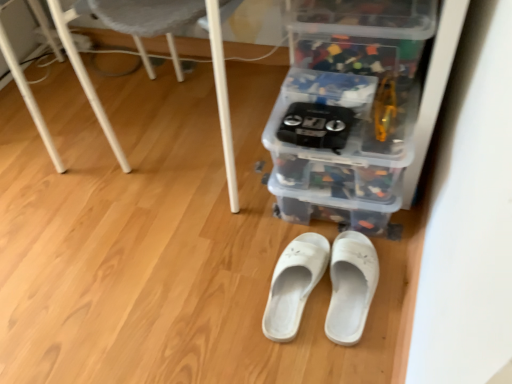
Question: Is translucent plastic storage box at center, the 3th storage box in the bottom-to-top sequence, taller than white fabric slippers at center, the 1th footwear from the left?

Choices:
 (A) no
 (B) yes

Answer: (B)

Question: From a real-world perspective, is translucent plastic storage box at center, the 1th storage box in the top-to-bottom sequence, on top of white fabric slippers at center, placed as the second footwear when sorted from right to left?

Choices:
 (A) yes
 (B) no

Answer: (A)

Question: Can you confirm if translucent plastic storage box at center, the 3th storage box in the bottom-to-top sequence, is thinner than white fabric slippers at center, the 1th footwear from the left?

Choices:
 (A) yes
 (B) no

Answer: (A)

Question: Is translucent plastic storage box at center, the 3th storage box in the bottom-to-top sequence, to the right of white fabric slippers at center, the 1th footwear from the left, from the viewer's perspective?

Choices:
 (A) no
 (B) yes

Answer: (B)

Question: From the image's perspective, is translucent plastic storage box at center, the 3th storage box in the bottom-to-top sequence, over white fabric slippers at center, the 1th footwear from the left?

Choices:
 (A) no
 (B) yes

Answer: (B)

Question: Which is correct: translucent plastic storage box at center, the 3th storage box in the bottom-to-top sequence, is inside white plastic chair at lower center, or outside of it?

Choices:
 (A) outside
 (B) inside

Answer: (A)

Question: Is point (369, 46) closer or farther from the camera than point (152, 4)?

Choices:
 (A) farther
 (B) closer

Answer: (B)

Question: Is translucent plastic storage box at center, the 1th storage box in the top-to-bottom sequence, in front of or behind white plastic chair at lower center in the image?

Choices:
 (A) front
 (B) behind

Answer: (B)

Question: Considering the positions of translucent plastic storage box at center, the 1th storage box in the top-to-bottom sequence, and white plastic chair at lower center in the image, is translucent plastic storage box at center, the 1th storage box in the top-to-bottom sequence, wider or thinner than white plastic chair at lower center?

Choices:
 (A) thin
 (B) wide

Answer: (A)

Question: In the image, is white plastic chair at lower center on the left side or the right side of white fabric slipper at center, the 2th footwear positioned from the left?

Choices:
 (A) right
 (B) left

Answer: (B)

Question: Considering their positions, is white plastic chair at lower center located in front of or behind white fabric slipper at center, the 2th footwear positioned from the left?

Choices:
 (A) behind
 (B) front

Answer: (B)

Question: Is white plastic chair at lower center taller or shorter than white fabric slipper at center, which is the first footwear from right to left?

Choices:
 (A) short
 (B) tall

Answer: (B)

Question: From the image's perspective, is white plastic chair at lower center above or below white fabric slipper at center, the 2th footwear positioned from the left?

Choices:
 (A) above
 (B) below

Answer: (A)

Question: From their relative heights in the image, would you say white fabric slipper at center, which is the first footwear from right to left, is taller or shorter than white plastic chair at lower center?

Choices:
 (A) tall
 (B) short

Answer: (B)

Question: Is white fabric slipper at center, which is the first footwear from right to left, spatially inside white plastic chair at lower center, or outside of it?

Choices:
 (A) inside
 (B) outside

Answer: (B)